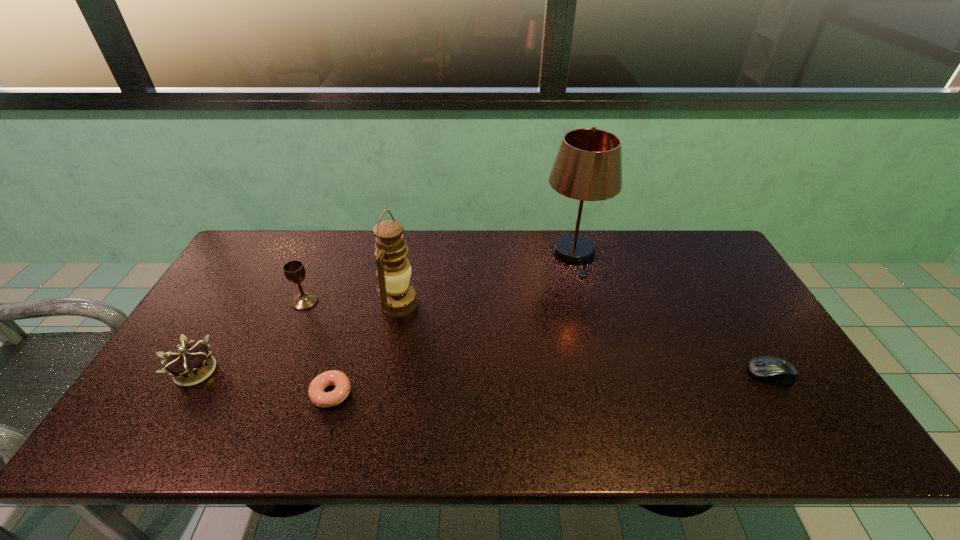
Where is `free region at the near edge of the desktop`? Image resolution: width=960 pixels, height=540 pixels. free region at the near edge of the desktop is located at coordinates (218, 417).

Locate an element on the screen. free location at the left edge of the desktop is located at coordinates (x=258, y=287).

Where is `vacant region at the right edge`? Image resolution: width=960 pixels, height=540 pixels. vacant region at the right edge is located at coordinates (728, 303).

Where is `vacant space at the near left corner of the desktop`? The image size is (960, 540). vacant space at the near left corner of the desktop is located at coordinates (174, 424).

The image size is (960, 540). In the image, there is a desktop. Find the location of `vacant space at the far right corner`. vacant space at the far right corner is located at coordinates (688, 269).

Where is `free space between the third object from right to left and the crown`? free space between the third object from right to left and the crown is located at coordinates (298, 337).

Image resolution: width=960 pixels, height=540 pixels. In order to click on vacant point located between the fourth shortest object and the fourth object from right to left in this screenshot , I will do `click(318, 347)`.

At what (x,y) coordinates should I click in order to perform the action: click on free space between the third object from left to right and the mouse. Please return your answer as a coordinate pair (x, y). This screenshot has width=960, height=540. Looking at the image, I should click on (551, 384).

Where is `free space between the leftmost object and the third object from right to left`? Image resolution: width=960 pixels, height=540 pixels. free space between the leftmost object and the third object from right to left is located at coordinates pos(298,337).

Find the location of a particular element. free space between the second object from right to left and the third tallest object is located at coordinates (440, 278).